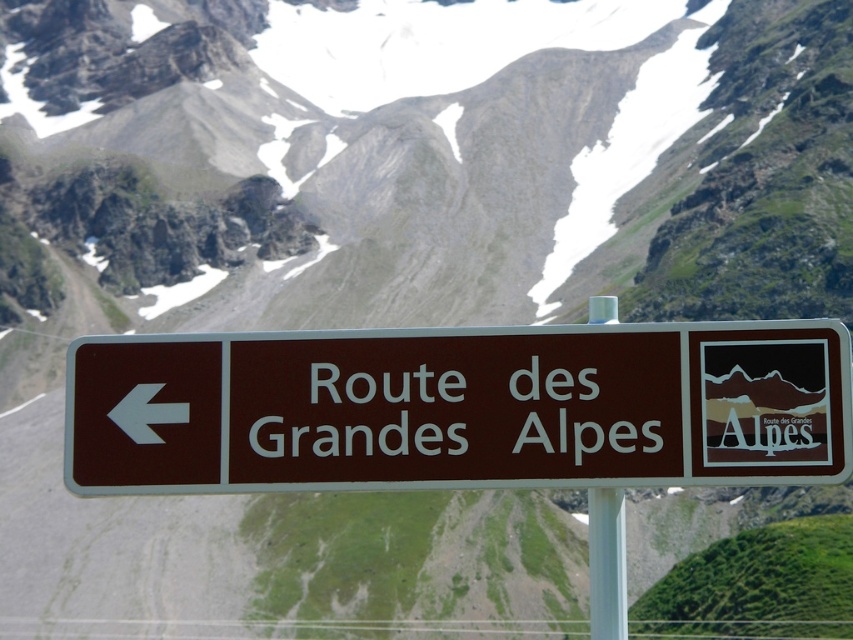
You are a hiker carrying a 16 feet long tent pole. You need to pass through the area between the brown plastic sign at center and the white plastic pole at center. Can your tent pole fit through the space between them without bending?

The brown plastic sign at center and white plastic pole at center are 15.76 feet apart from each other. Since the tent pole is 16 feet long, it is longer than the space between them. Therefore, the tent pole cannot fit through the space between them without bending.

You are standing in front of a road sign. There is a point at coordinates point (460, 408). What object is located at that point?

The point (460, 408) corresponds to the brown plastic sign at center.